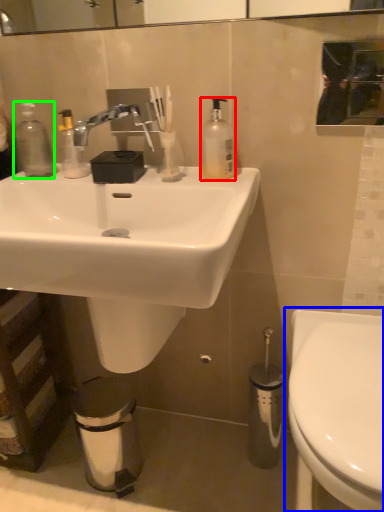
Question: Based on their relative distances, which object is nearer to soap dispenser (highlighted by a red box)? Choose from toilet (highlighted by a blue box) and bottle (highlighted by a green box).

Choices:
 (A) toilet
 (B) bottle

Answer: (B)